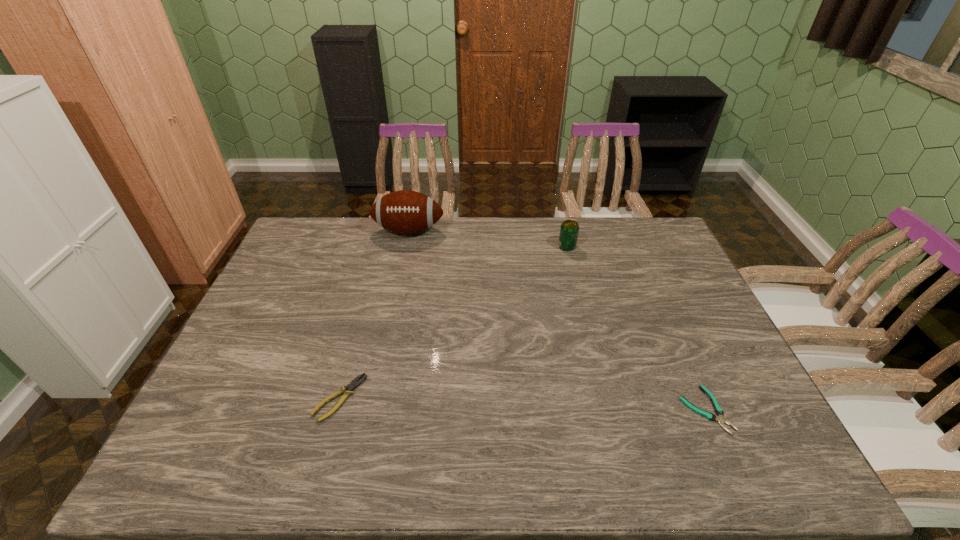
Locate which object ranks third in proximity to the beer can. Please provide its 2D coordinates. Your answer should be formatted as a tuple, i.e. [(x, y)], where the tuple contains the x and y coordinates of a point satisfying the conditions above.

[(348, 390)]

I want to click on vacant space that satisfies the following two spatial constraints: 1. on the laces of the football; 2. on the left side of the second object from right to left, so click(x=405, y=246).

The width and height of the screenshot is (960, 540). Identify the location of vacant area that satisfies the following two spatial constraints: 1. on the laces of the football; 2. on the right side of the third object from left to right. (405, 246).

Locate an element on the screen. free spot that satisfies the following two spatial constraints: 1. on the laces of the tallest object; 2. on the left side of the shorter pliers is located at coordinates coord(371,409).

The height and width of the screenshot is (540, 960). I want to click on free space that satisfies the following two spatial constraints: 1. on the front side of the left pliers; 2. on the left side of the shortest object, so click(336, 409).

Find the location of `free spot that satisfies the following two spatial constraints: 1. on the laces of the football; 2. on the left side of the rightmost object`. free spot that satisfies the following two spatial constraints: 1. on the laces of the football; 2. on the left side of the rightmost object is located at coordinates (371, 409).

At what (x,y) coordinates should I click in order to perform the action: click on free space that satisfies the following two spatial constraints: 1. on the back side of the beer can; 2. on the left side of the left pliers. Please return your answer as a coordinate pair (x, y). The width and height of the screenshot is (960, 540). Looking at the image, I should click on (382, 246).

Locate an element on the screen. vacant point that satisfies the following two spatial constraints: 1. on the front side of the right pliers; 2. on the left side of the third tallest object is located at coordinates (336, 409).

Identify the location of vacant space that satisfies the following two spatial constraints: 1. on the back side of the left pliers; 2. on the left side of the second object from right to left. This screenshot has height=540, width=960. (382, 246).

Where is `free point that satisfies the following two spatial constraints: 1. on the laces of the beer can; 2. on the left side of the football`? free point that satisfies the following two spatial constraints: 1. on the laces of the beer can; 2. on the left side of the football is located at coordinates (405, 246).